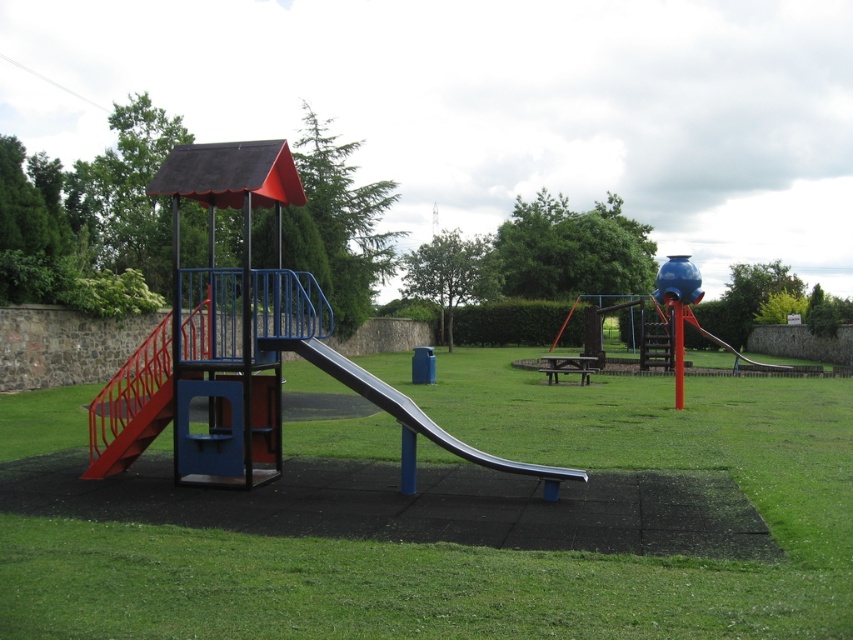
You are planning to place a new play mat that covers the entire area of the metallic blue slide at center. Based on the scene, will the play mat also cover part of the green grass at center?

The green grass at center is bigger than the metallic blue slide at center, so placing a play mat that covers the entire metallic blue slide at center will also cover part of the green grass at center.

You are a child standing at the edge of the playground. You want to run towards the green grass at center and the metallic blue slide at center. Which one will you reach first?

The green grass at center is closer to the viewer than the metallic blue slide at center, so you will reach the green grass at center first.

You are a parent trying to decide where to place a small picnic blanket. You see the green grass at center and the metallic blue slide at center. Which area is shorter in height?

The green grass at center is not as tall as the metallic blue slide at center, so the green grass at center is shorter in height.